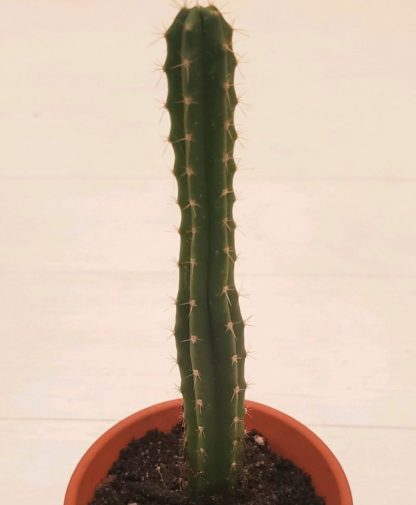
What are the coordinates of `terra cotta pot` in the screenshot? It's located at (281, 433).